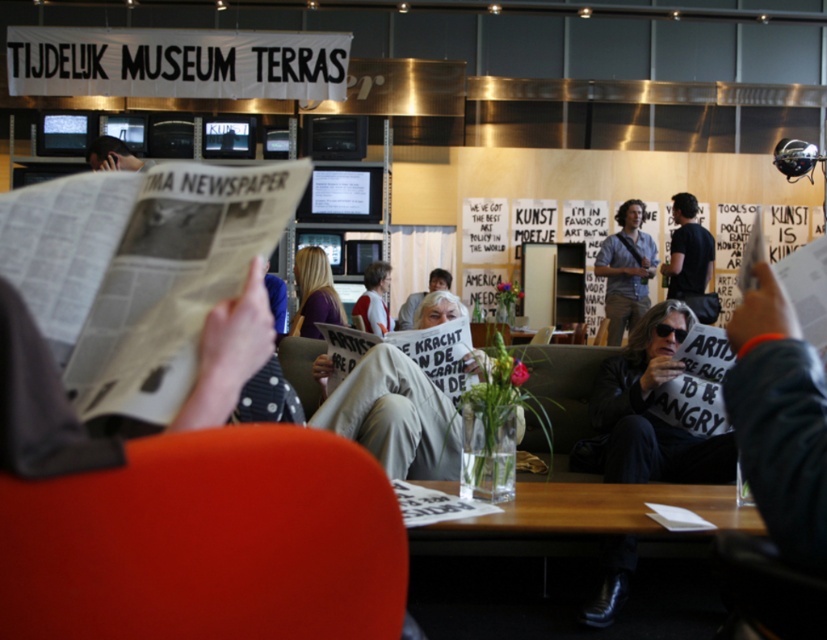
Question: Can you confirm if purple fabric shirt at center is positioned to the left of matte white shirt at center?

Choices:
 (A) no
 (B) yes

Answer: (B)

Question: Can you confirm if purple fabric shirt at center is wider than leather armchair at center?

Choices:
 (A) no
 (B) yes

Answer: (B)

Question: Which point is farther from the camera taking this photo?

Choices:
 (A) (416, 308)
 (B) (103, 161)
 (C) (609, 342)
 (D) (462, 532)

Answer: (C)

Question: Which object appears farthest from the camera in this image?

Choices:
 (A) matte white shirt at center
 (B) black cotton shirt at center
 (C) white paper newspaper at center
 (D) matte red armchair at lower left

Answer: (B)

Question: Is black cotton shirt at center thinner than white paper banner at center?

Choices:
 (A) yes
 (B) no

Answer: (A)

Question: Estimate the real-world distances between objects in this image. Which object is farther from the white paper newspaper at center?

Choices:
 (A) matte white shirt at center
 (B) leather armchair at center
 (C) black cotton shirt at center
 (D) matte red armchair at lower left

Answer: (C)